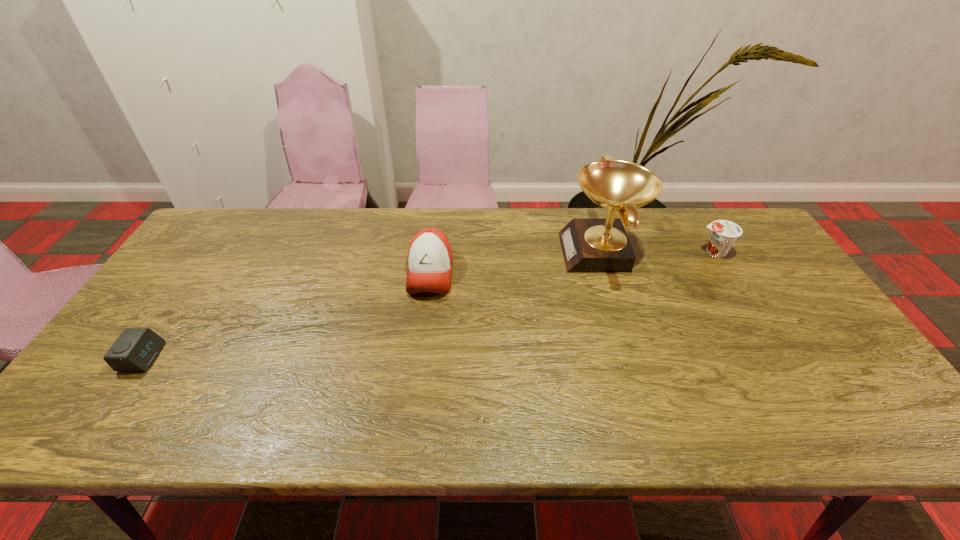
Where is `vacant area that lies between the third object from left to right and the third tallest object`? vacant area that lies between the third object from left to right and the third tallest object is located at coordinates (658, 252).

The height and width of the screenshot is (540, 960). Find the location of `free space between the baseball cap and the tallest object`. free space between the baseball cap and the tallest object is located at coordinates (516, 262).

Image resolution: width=960 pixels, height=540 pixels. What are the coordinates of `object that ranks as the third closest to the alarm clock` in the screenshot? It's located at (724, 233).

Locate an element on the screen. object that is the third closest one to the rightmost object is located at coordinates (136, 349).

This screenshot has height=540, width=960. What are the coordinates of `vacant area that satisfies the following two spatial constraints: 1. on the front-facing side of the award; 2. on the front-facing side of the baseball cap` in the screenshot? It's located at (607, 273).

This screenshot has height=540, width=960. Identify the location of blank space that satisfies the following two spatial constraints: 1. on the front-facing side of the third object from right to left; 2. on the front-facing side of the leftmost object. (420, 357).

Identify the location of vacant position in the image that satisfies the following two spatial constraints: 1. on the front-facing side of the third object from right to left; 2. on the front-facing side of the nearest object. (420, 357).

This screenshot has height=540, width=960. In order to click on free spot that satisfies the following two spatial constraints: 1. on the front side of the rightmost object; 2. on the front-facing side of the leftmost object in this screenshot , I will do `click(777, 357)`.

At what (x,y) coordinates should I click in order to perform the action: click on free location that satisfies the following two spatial constraints: 1. on the front-facing side of the award; 2. on the front-facing side of the second object from left to right. Please return your answer as a coordinate pair (x, y). Looking at the image, I should click on (607, 273).

You are a GUI agent. You are given a task and a screenshot of the screen. Output one action in this format:
    pyautogui.click(x=<x>, y=<y>)
    Task: Click on the free spot that satisfies the following two spatial constraints: 1. on the front-facing side of the baseball cap; 2. on the front-facing side of the alarm clock
    The height and width of the screenshot is (540, 960).
    Given the screenshot: What is the action you would take?
    (420, 357)